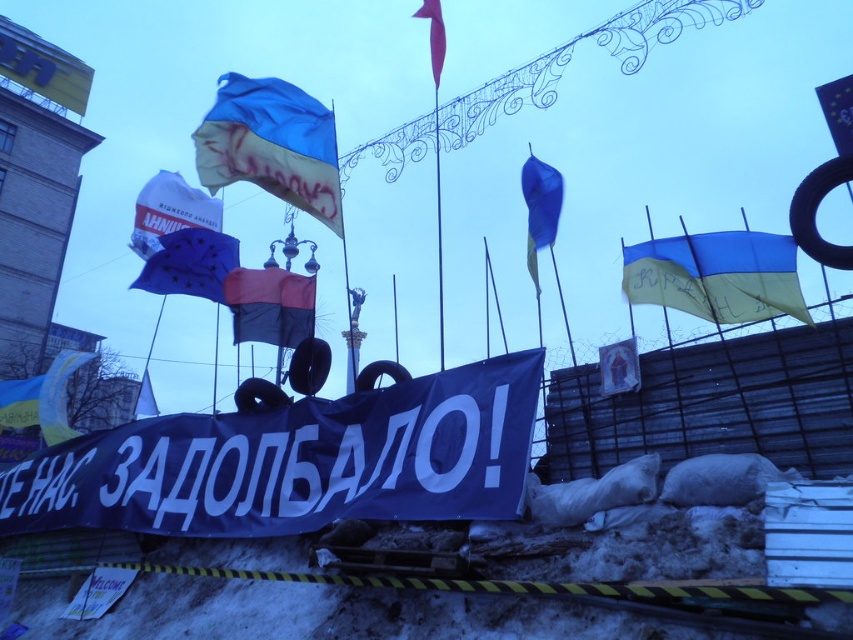
Based on the photo, between blue/yellow fabric flag at upper right and matte red flag at upper center, which one is positioned lower?

blue/yellow fabric flag at upper right is lower down.

Is blue/yellow fabric flag at upper right wider than matte red flag at upper center?

Correct, the width of blue/yellow fabric flag at upper right exceeds that of matte red flag at upper center.

Identify the location of blue/yellow fabric flag at upper right. (717, 275).

Which is behind, point (636, 285) or point (293, 326)?

The point (293, 326) is more distant.

Between blue/yellow fabric flag at upper right and black matte flag at center, which one is positioned lower?

black matte flag at center is lower down.

Who is more distant from viewer, [775,250] or [242,337]?

Positioned behind is point [242,337].

You are a GUI agent. You are given a task and a screenshot of the screen. Output one action in this format:
    pyautogui.click(x=<x>, y=<y>)
    Task: Click on the blue/yellow fabric flag at upper right
    This screenshot has height=640, width=853.
    Given the screenshot: What is the action you would take?
    pyautogui.click(x=717, y=275)

Which is behind, point (294, 86) or point (659, 241)?

Point (294, 86)

Can you confirm if blue fabric flag at upper center is positioned to the right of blue/yellow fabric flag at upper right?

No, blue fabric flag at upper center is not to the right of blue/yellow fabric flag at upper right.

What are the coordinates of `blue fabric flag at upper center` in the screenshot? It's located at (271, 145).

This screenshot has height=640, width=853. I want to click on blue fabric flag at upper center, so tap(271, 145).